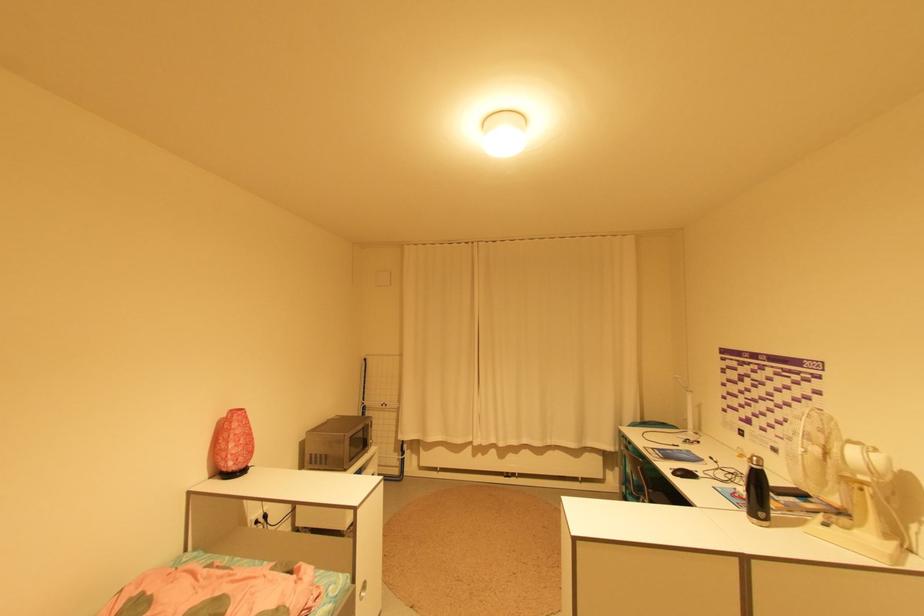
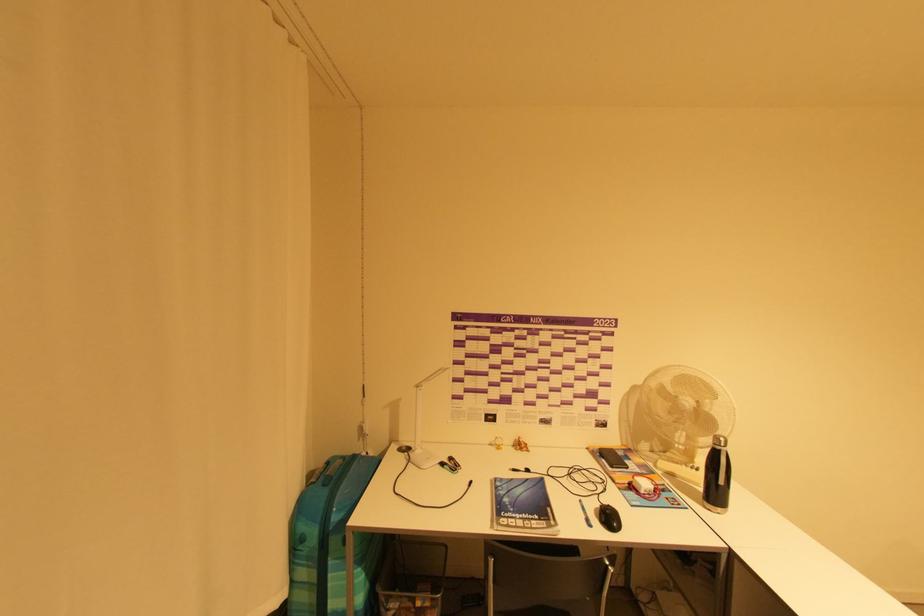
Find the pixel in the second image that matches [700,456] in the first image.

(517, 480)